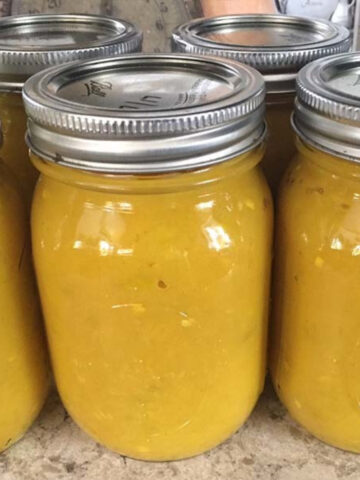
Find the location of a particular element. This screenshot has height=480, width=360. mason jars is located at coordinates [x=170, y=241], [x=358, y=322], [x=23, y=362].